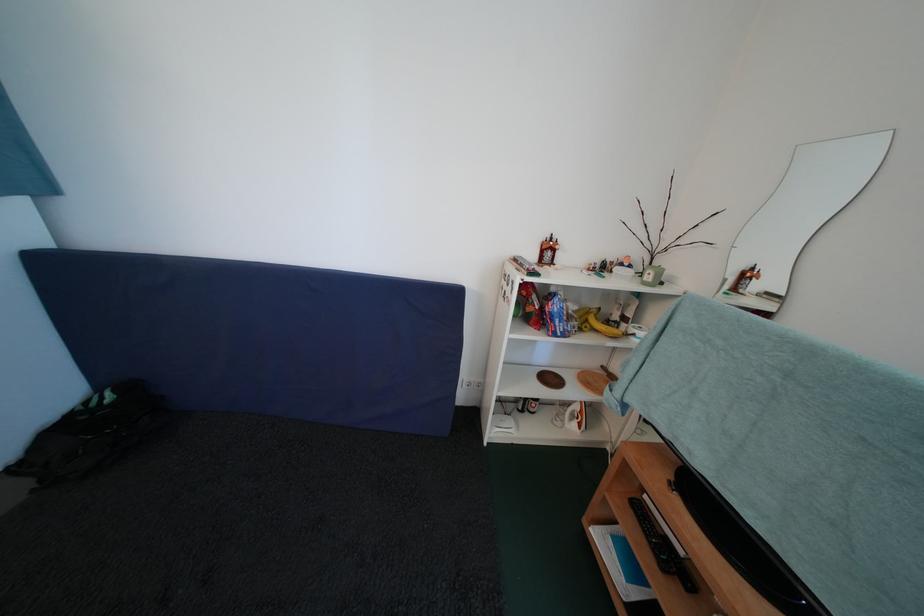
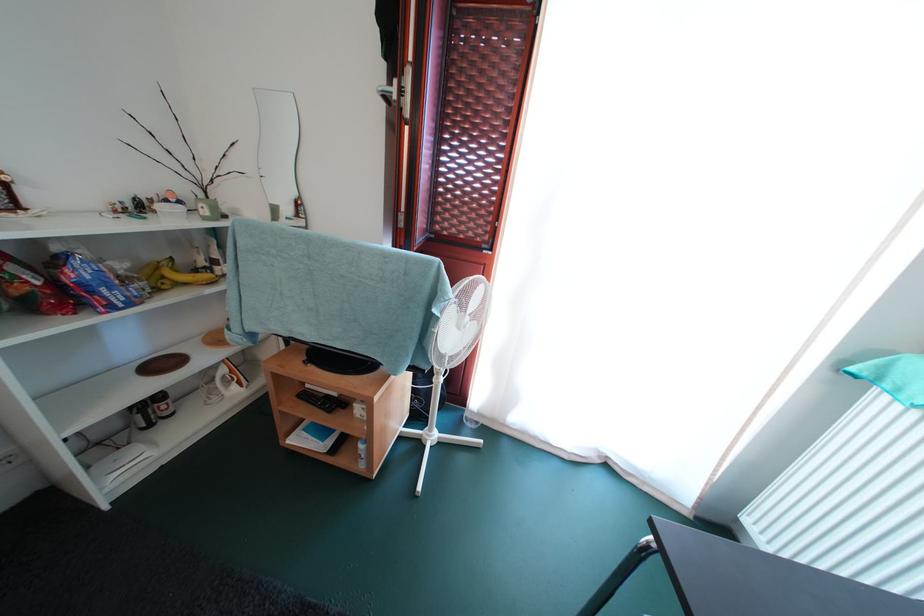
Find the pixel in the second image that matches point (623, 328) in the first image.

(213, 273)